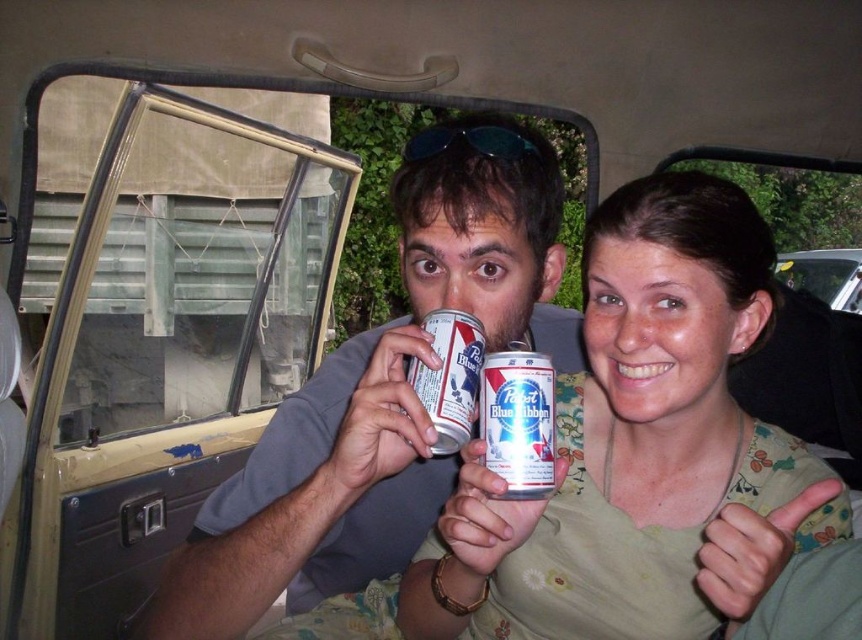
Based on the photo, between blue metallic can at center and matte silver can at center, which one appears on the right side from the viewer's perspective?

blue metallic can at center is more to the right.

Describe the element at coordinates (517, 420) in the screenshot. I see `blue metallic can at center` at that location.

Find the location of `blue metallic can at center`. blue metallic can at center is located at coordinates (517, 420).

Based on the photo, between matte green blouse at center and blue metallic can at center, which one has more height?

matte green blouse at center is taller.

Who is positioned more to the right, matte green blouse at center or blue metallic can at center?

matte green blouse at center

The height and width of the screenshot is (640, 862). What are the coordinates of `matte green blouse at center` in the screenshot? It's located at (641, 449).

Describe the element at coordinates (641, 449) in the screenshot. I see `matte green blouse at center` at that location.

How much distance is there between matte green blouse at center and matte silver can at center?

A: The distance of matte green blouse at center from matte silver can at center is 8.27 inches.

Does point (486, 593) come in front of point (463, 349)?

No, (486, 593) is behind (463, 349).

Find the location of a particular element. matte green blouse at center is located at coordinates (641, 449).